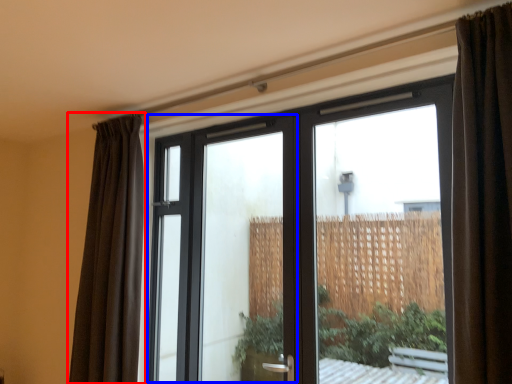
Question: Which of the following is the farthest to the observer, curtain (highlighted by a red box) or screen door (highlighted by a blue box)?

Choices:
 (A) curtain
 (B) screen door

Answer: (A)